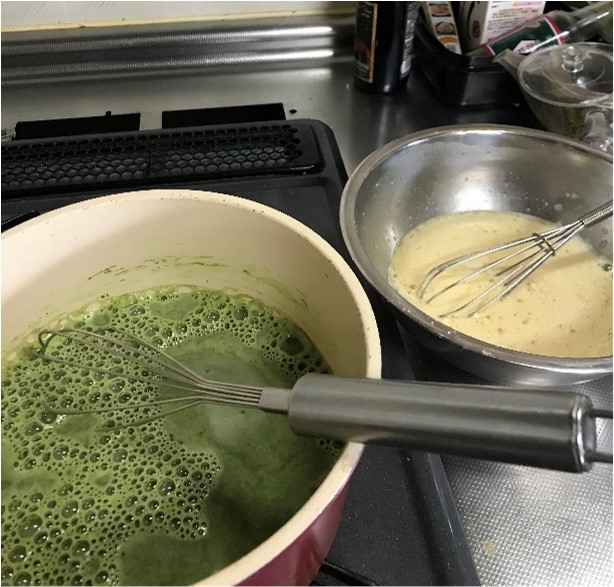
The width and height of the screenshot is (614, 587). Find the location of `wall`. wall is located at coordinates (131, 13).